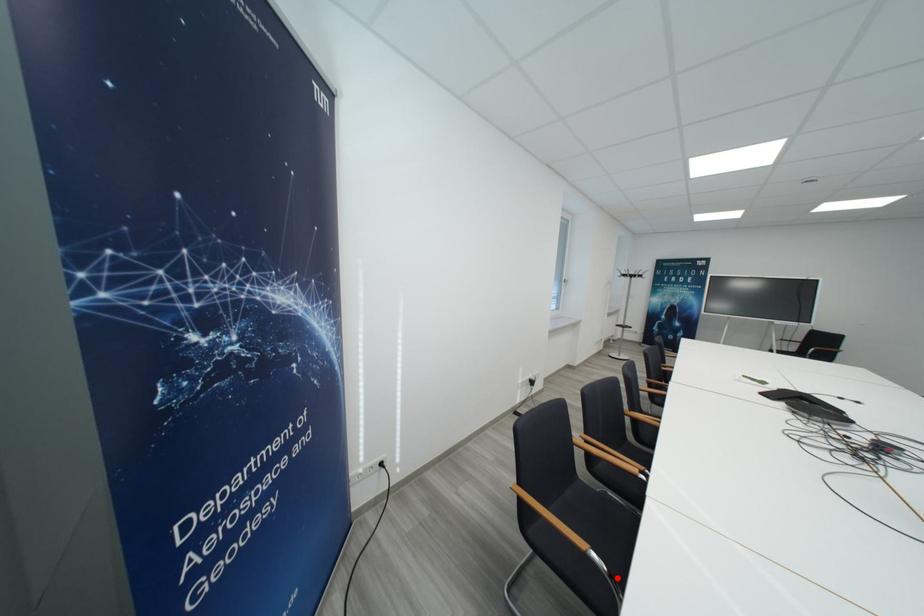
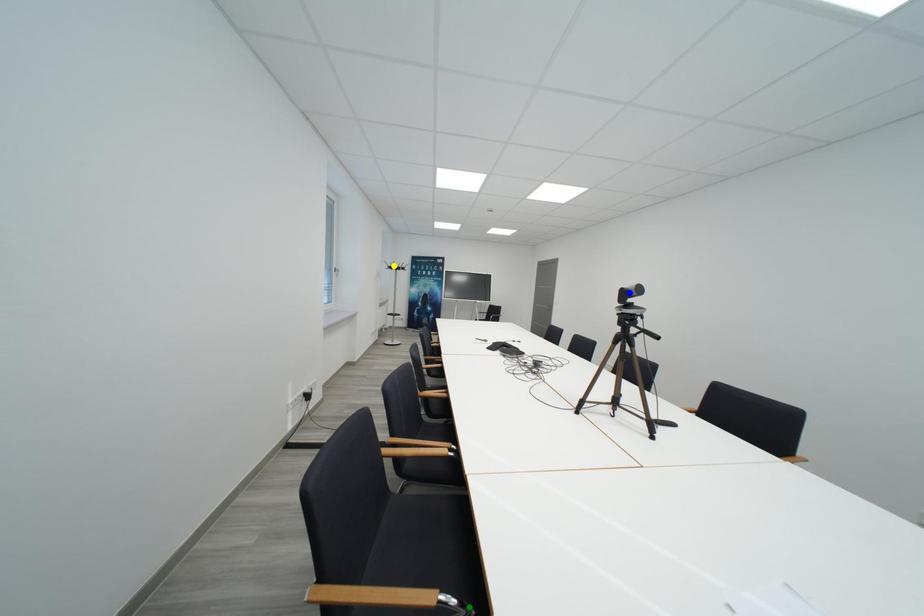
Question: I am providing you with two images of the same scene from different viewpoints. A red point is marked on the first image. You are given multiple points on the second image. Which point in image 2 represents the same 3d spot as the red point in image 1?

Choices:
 (A) green point
 (B) yellow point
 (C) blue point

Answer: (A)